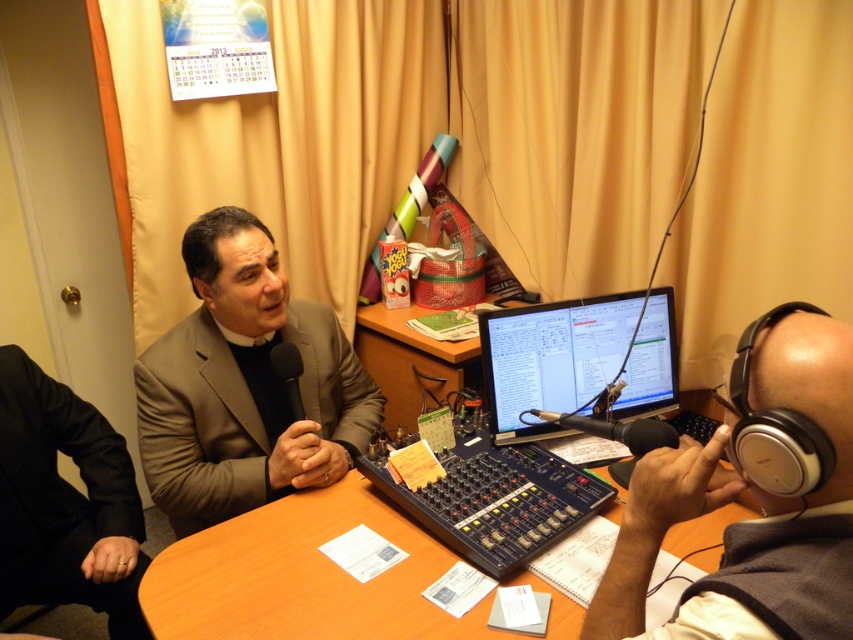
In the scene shown: Is white matte headphones at upper right in front of wooden desk at center?

Yes, it is.

What are the coordinates of `white matte headphones at upper right` in the screenshot? It's located at (757, 502).

At what (x,y) coordinates should I click in order to perform the action: click on white matte headphones at upper right. Please return your answer as a coordinate pair (x, y). Image resolution: width=853 pixels, height=640 pixels. Looking at the image, I should click on (757, 502).

Does wooden round table at center appear over wooden desk at center?

No, wooden round table at center is not above wooden desk at center.

Who is shorter, wooden round table at center or wooden desk at center?

wooden round table at center

The width and height of the screenshot is (853, 640). I want to click on wooden round table at center, so click(303, 577).

Which is in front, point (7, 364) or point (421, 312)?

Point (7, 364) is more forward.

This screenshot has width=853, height=640. I want to click on black fabric business suit at lower left, so click(65, 502).

Is point (21, 408) positioned behind point (415, 372)?

No, (21, 408) is in front of (415, 372).

Where is `black fabric business suit at lower left`? This screenshot has width=853, height=640. black fabric business suit at lower left is located at coordinates (65, 502).